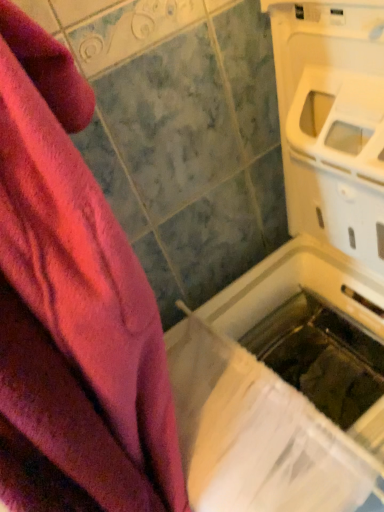
This screenshot has height=512, width=384. Describe the element at coordinates (301, 296) in the screenshot. I see `white plastic washing machine at upper right` at that location.

Find the location of a particular element. This screenshot has width=384, height=512. white plastic washing machine at upper right is located at coordinates (x=301, y=296).

This screenshot has width=384, height=512. Identify the location of white plastic washing machine at upper right. (301, 296).